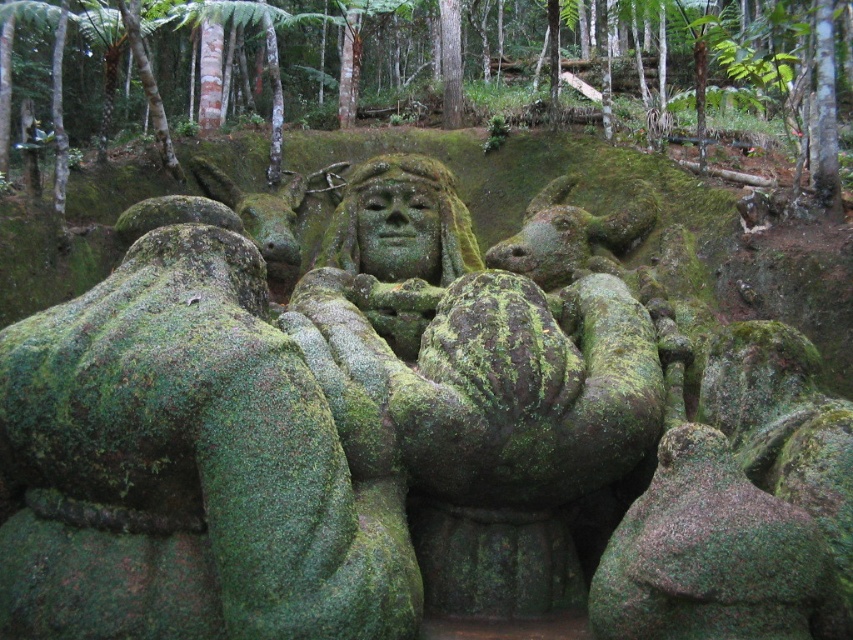
Does green mossy statue at center have a greater height compared to green mossy face at center?

Yes, green mossy statue at center is taller than green mossy face at center.

Between green mossy statue at center and green mossy face at center, which one has more height?

green mossy statue at center

Find the location of a particular element. This screenshot has height=640, width=853. green mossy statue at center is located at coordinates (701, 72).

At what (x,y) coordinates should I click in order to perform the action: click on green mossy statue at center. Please return your answer as a coordinate pair (x, y). The height and width of the screenshot is (640, 853). Looking at the image, I should click on (701, 72).